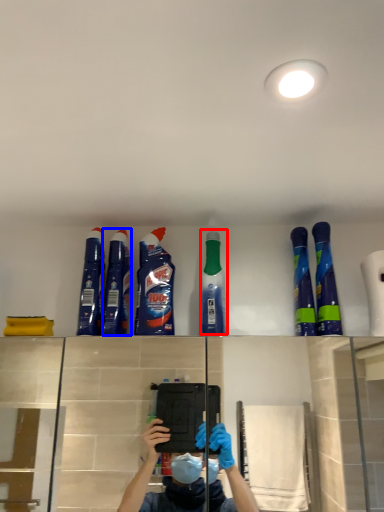
Question: Which object is further to the camera taking this photo, cleaning product (highlighted by a red box) or cleaning product (highlighted by a blue box)?

Choices:
 (A) cleaning product
 (B) cleaning product

Answer: (B)